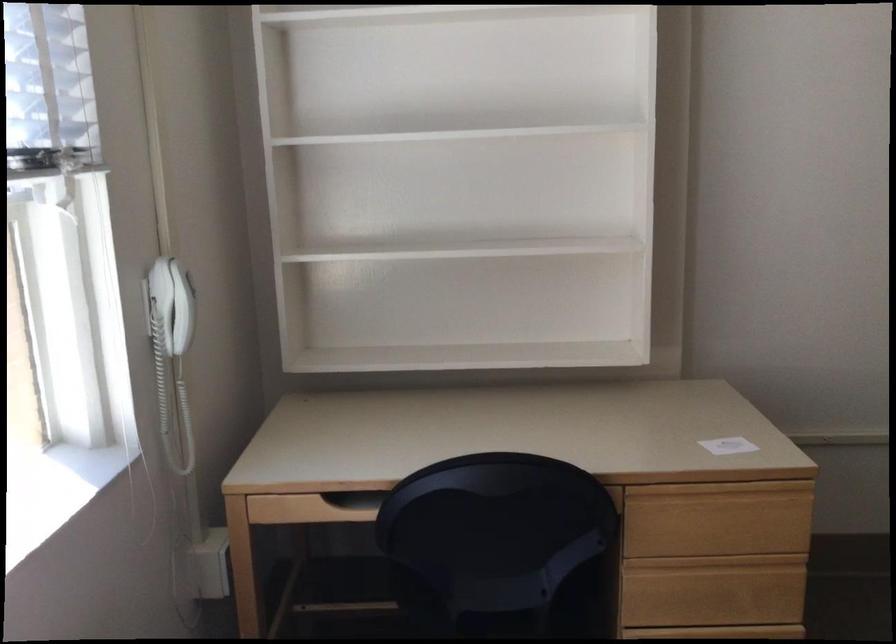
Find where to lift the white telephone handset. Please return your answer as a coordinate pair (x, y).

(171, 304)